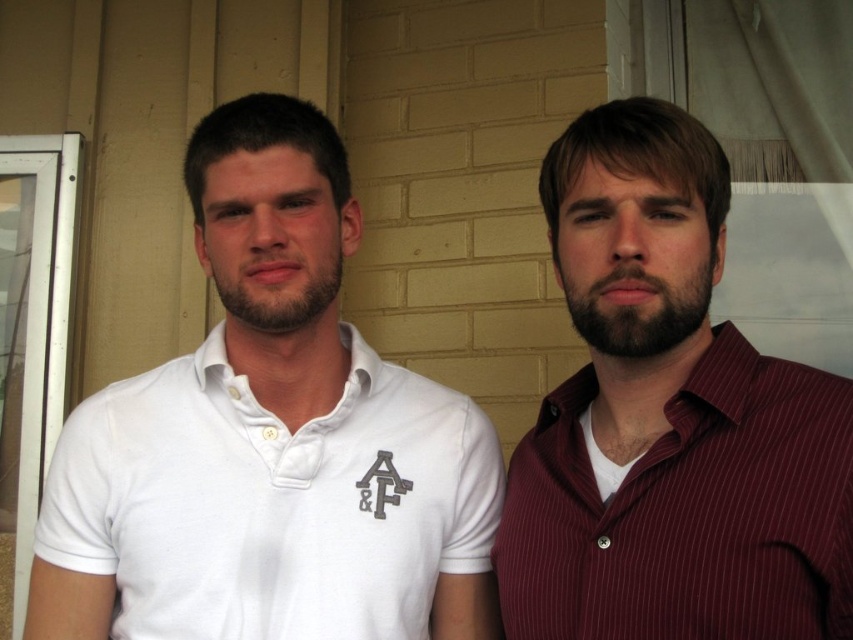
Does point (352, 211) lie in front of point (769, 637)?

No.

I want to click on white cotton polo shirt at left, so click(270, 440).

The width and height of the screenshot is (853, 640). I want to click on white cotton polo shirt at left, so click(270, 440).

What are the coordinates of `white cotton polo shirt at left` in the screenshot? It's located at point(270,440).